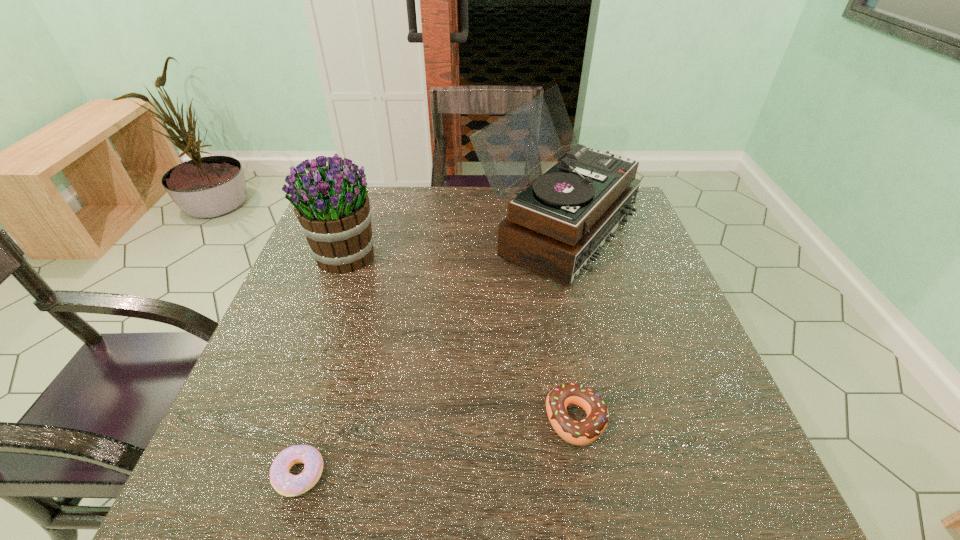
Find the location of a particular element. object at the far edge is located at coordinates (557, 225).

This screenshot has width=960, height=540. Find the location of `object that is at the near edge`. object that is at the near edge is located at coordinates (286, 484).

The image size is (960, 540). I want to click on bouquet at the left edge, so click(x=331, y=204).

Find the location of `doughnut at the left edge`. doughnut at the left edge is located at coordinates (286, 484).

This screenshot has width=960, height=540. I want to click on object present at the right edge, so click(x=557, y=225).

What are the coordinates of `object present at the near left corner` in the screenshot? It's located at (286, 484).

I want to click on object that is positioned at the far right corner, so click(x=557, y=225).

At what (x,y) coordinates should I click in order to perform the action: click on blank area at the far edge. Please return your answer as a coordinate pair (x, y). The width and height of the screenshot is (960, 540). Looking at the image, I should click on (484, 219).

What are the coordinates of `vacant space at the near edge of the desktop` in the screenshot? It's located at (653, 464).

Image resolution: width=960 pixels, height=540 pixels. In the image, there is a desktop. Find the location of `blank space at the left edge`. blank space at the left edge is located at coordinates (352, 293).